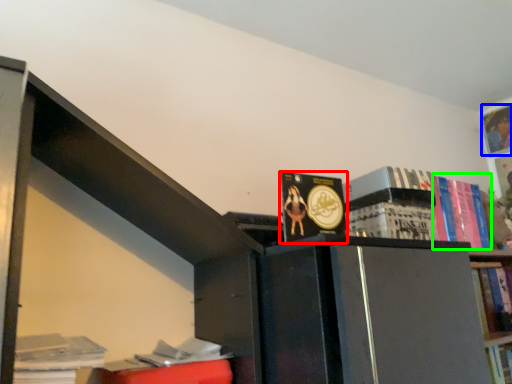
Question: Which is nearer to the book (highlighted by a red box)? book (highlighted by a blue box) or book (highlighted by a green box).

Choices:
 (A) book
 (B) book

Answer: (B)